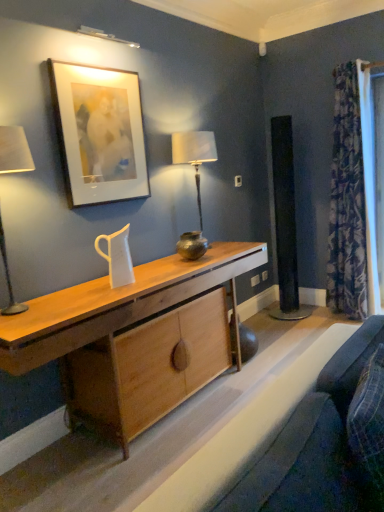
Question: From a real-world perspective, is metallic silver table lamp at center physically below velvet blue cushion at lower right, placed as the first swivel chair when sorted from right to left?

Choices:
 (A) yes
 (B) no

Answer: (B)

Question: Is metallic silver table lamp at center far from velvet blue cushion at lower right, the 2th swivel chair when ordered from left to right?

Choices:
 (A) yes
 (B) no

Answer: (A)

Question: Is metallic silver table lamp at center turned away from velvet blue cushion at lower right, the 2th swivel chair when ordered from left to right?

Choices:
 (A) yes
 (B) no

Answer: (B)

Question: Is metallic silver table lamp at center facing towards velvet blue cushion at lower right, placed as the first swivel chair when sorted from right to left?

Choices:
 (A) yes
 (B) no

Answer: (B)

Question: Is velvet blue cushion at lower right, placed as the first swivel chair when sorted from right to left, a part of metallic silver table lamp at center?

Choices:
 (A) yes
 (B) no

Answer: (B)

Question: In terms of width, does metallic silver table lamp at center look wider or thinner when compared to patterned fabric curtain at right?

Choices:
 (A) wide
 (B) thin

Answer: (B)

Question: From the image's perspective, is metallic silver table lamp at center positioned above or below patterned fabric curtain at right?

Choices:
 (A) below
 (B) above

Answer: (A)

Question: In terms of size, does metallic silver table lamp at center appear bigger or smaller than patterned fabric curtain at right?

Choices:
 (A) big
 (B) small

Answer: (B)

Question: Is metallic silver table lamp at center situated inside patterned fabric curtain at right or outside?

Choices:
 (A) outside
 (B) inside

Answer: (A)

Question: Considering the positions of velvet blue cushion at lower right, placed as the first swivel chair when sorted from right to left, and natural wood desk at center in the image, is velvet blue cushion at lower right, placed as the first swivel chair when sorted from right to left, wider or thinner than natural wood desk at center?

Choices:
 (A) thin
 (B) wide

Answer: (A)

Question: Considering their positions, is velvet blue cushion at lower right, the 2th swivel chair when ordered from left to right, located in front of or behind natural wood desk at center?

Choices:
 (A) front
 (B) behind

Answer: (A)

Question: Considering the positions of velvet blue cushion at lower right, placed as the first swivel chair when sorted from right to left, and natural wood desk at center in the image, is velvet blue cushion at lower right, placed as the first swivel chair when sorted from right to left, bigger or smaller than natural wood desk at center?

Choices:
 (A) small
 (B) big

Answer: (A)

Question: Would you say velvet blue cushion at lower right, the 2th swivel chair when ordered from left to right, is inside or outside natural wood desk at center?

Choices:
 (A) outside
 (B) inside

Answer: (A)

Question: From a real-world perspective, is patterned fabric curtain at right above or below velvet blue cushion at lower right, the 2th swivel chair when ordered from left to right?

Choices:
 (A) below
 (B) above

Answer: (B)

Question: Considering their positions, is patterned fabric curtain at right located in front of or behind velvet blue cushion at lower right, placed as the first swivel chair when sorted from right to left?

Choices:
 (A) front
 (B) behind

Answer: (B)